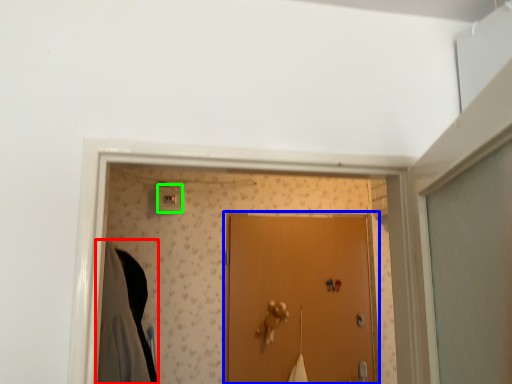
Question: Which object is positioned farthest from robe (highlighted by a red box)? Select from door (highlighted by a blue box) and light switch (highlighted by a green box).

Choices:
 (A) door
 (B) light switch

Answer: (A)